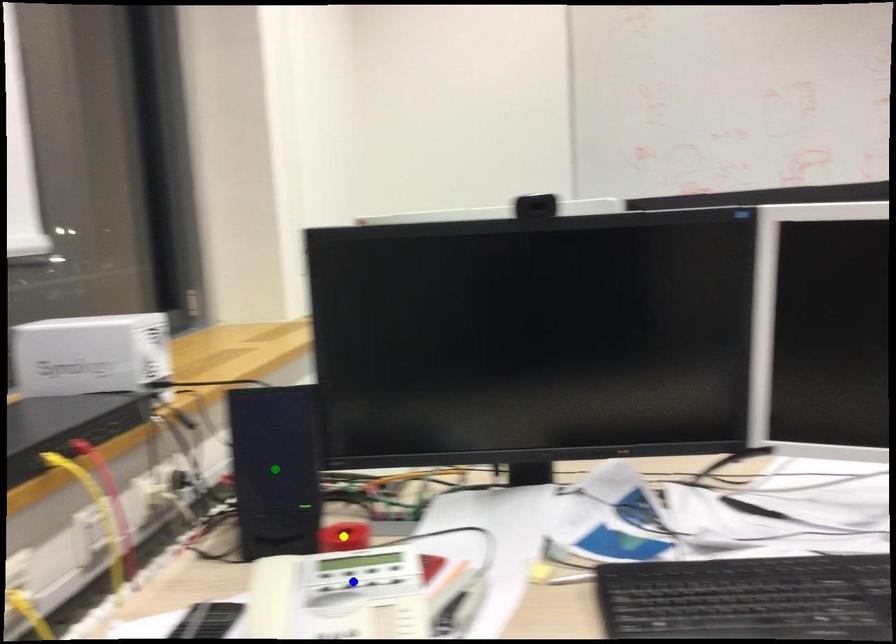
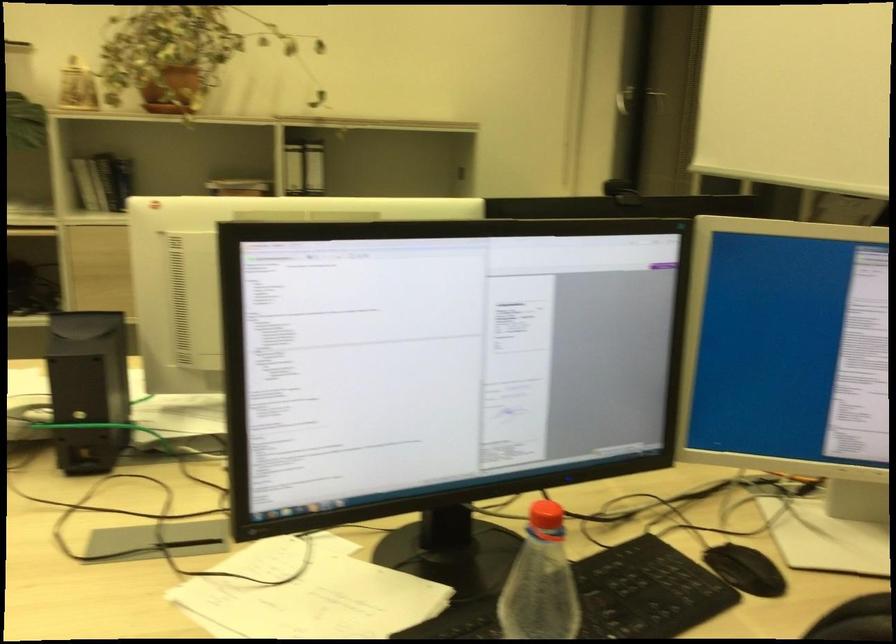
I am providing you with two images of the same scene from different viewpoints. Three points are marked in image1. Which point corresponds to a part or object that is occluded in image2?In image1, three points are marked. Which of them correspond to a part or object that is occluded in image2?Among the three points shown in image1, which one corresponds to a part or object that is no longer visible due to occlusion in image2?

yellow point, blue point, green point